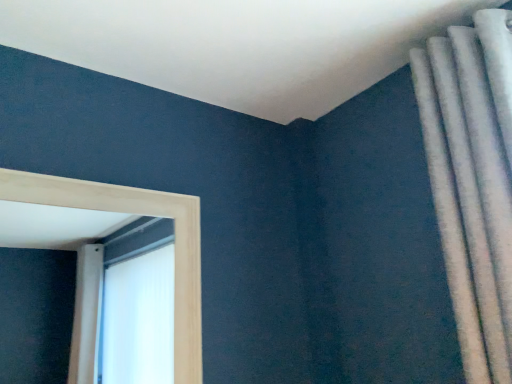
Question: Would you say white textured curtain at upper right is to the left or to the right of light wood frame at left in the picture?

Choices:
 (A) left
 (B) right

Answer: (B)

Question: Considering the positions of white textured curtain at upper right and light wood frame at left in the image, is white textured curtain at upper right taller or shorter than light wood frame at left?

Choices:
 (A) short
 (B) tall

Answer: (B)

Question: In terms of width, does white textured curtain at upper right look wider or thinner when compared to light wood frame at left?

Choices:
 (A) thin
 (B) wide

Answer: (B)

Question: Which is correct: light wood frame at left is inside white textured curtain at upper right, or outside of it?

Choices:
 (A) outside
 (B) inside

Answer: (A)

Question: Is light wood frame at left to the left or to the right of white textured curtain at upper right in the image?

Choices:
 (A) right
 (B) left

Answer: (B)

Question: In terms of width, does light wood frame at left look wider or thinner when compared to white textured curtain at upper right?

Choices:
 (A) wide
 (B) thin

Answer: (B)

Question: Considering the positions of light wood frame at left and white textured curtain at upper right in the image, is light wood frame at left bigger or smaller than white textured curtain at upper right?

Choices:
 (A) big
 (B) small

Answer: (B)